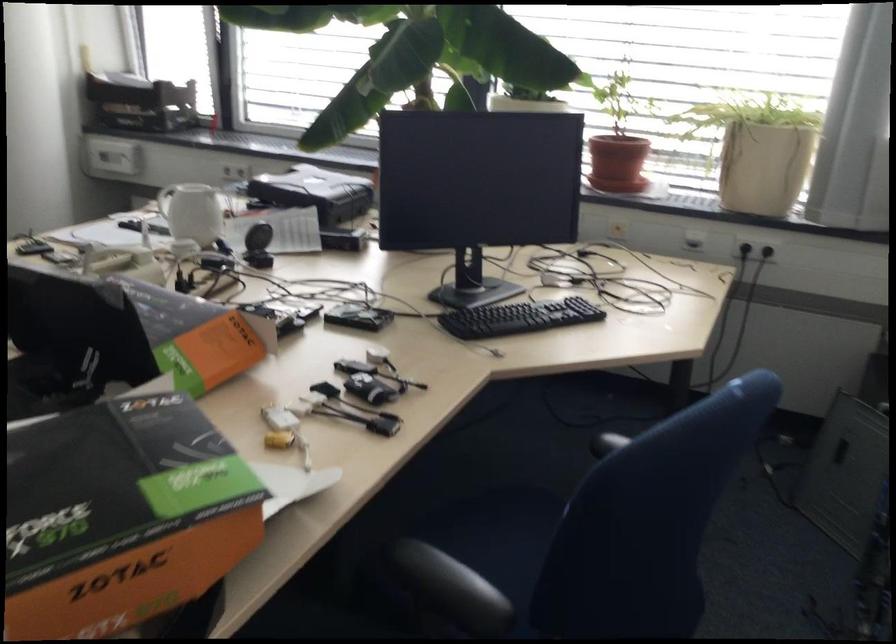
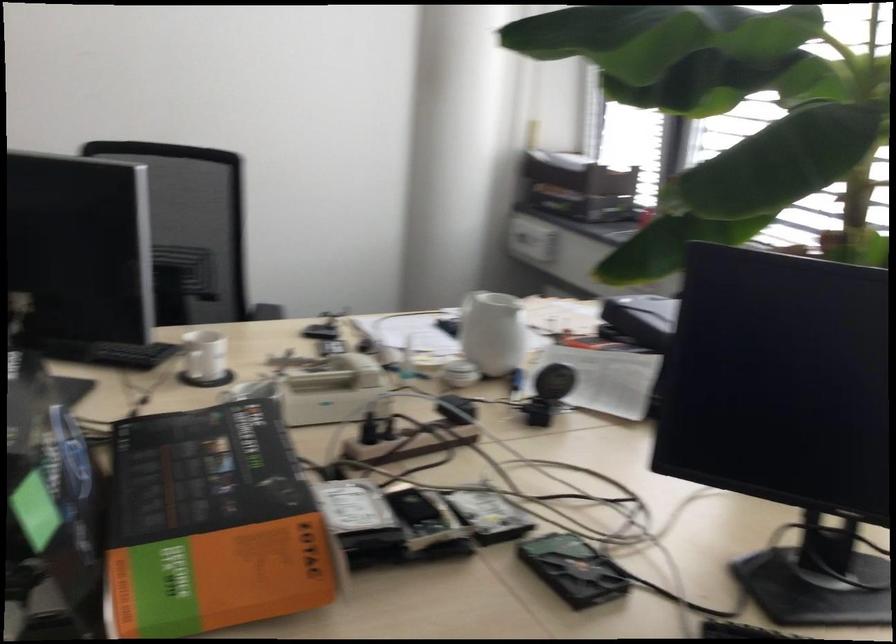
Question: The first image is from the beginning of the video and the second image is from the end. How did the camera likely rotate when shooting the video?

Choices:
 (A) Left
 (B) Right
 (C) Up
 (D) Down

Answer: (A)